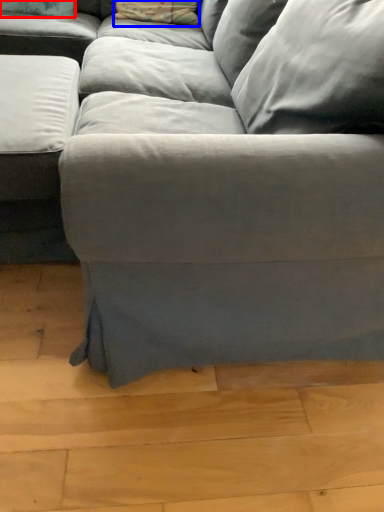
Question: Which object appears closest to the camera in this image, pillow (highlighted by a red box) or pillow (highlighted by a blue box)?

Choices:
 (A) pillow
 (B) pillow

Answer: (A)